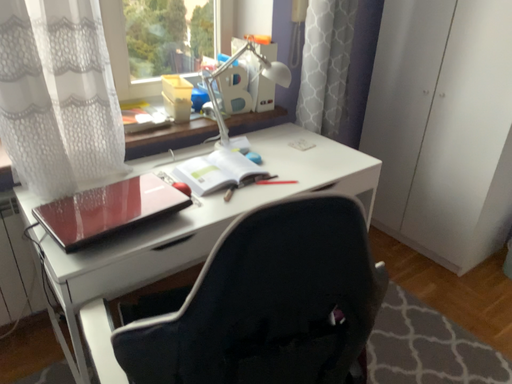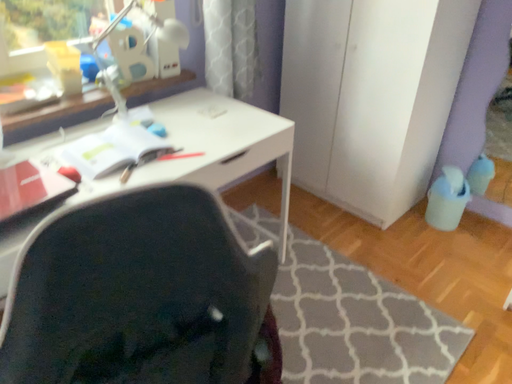
Question: How did the camera likely rotate when shooting the video?

Choices:
 (A) rotated right
 (B) rotated left

Answer: (A)